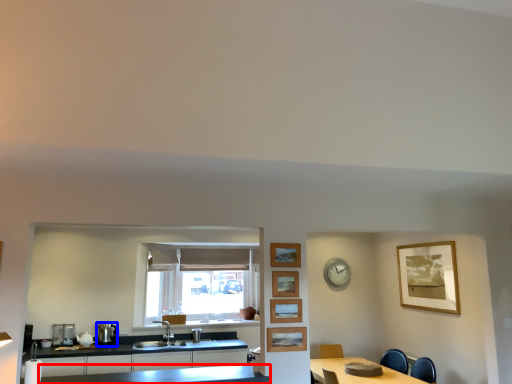
Question: Which of the following is the closest to the observer, countertop (highlighted by a red box) or appliance (highlighted by a blue box)?

Choices:
 (A) countertop
 (B) appliance

Answer: (A)